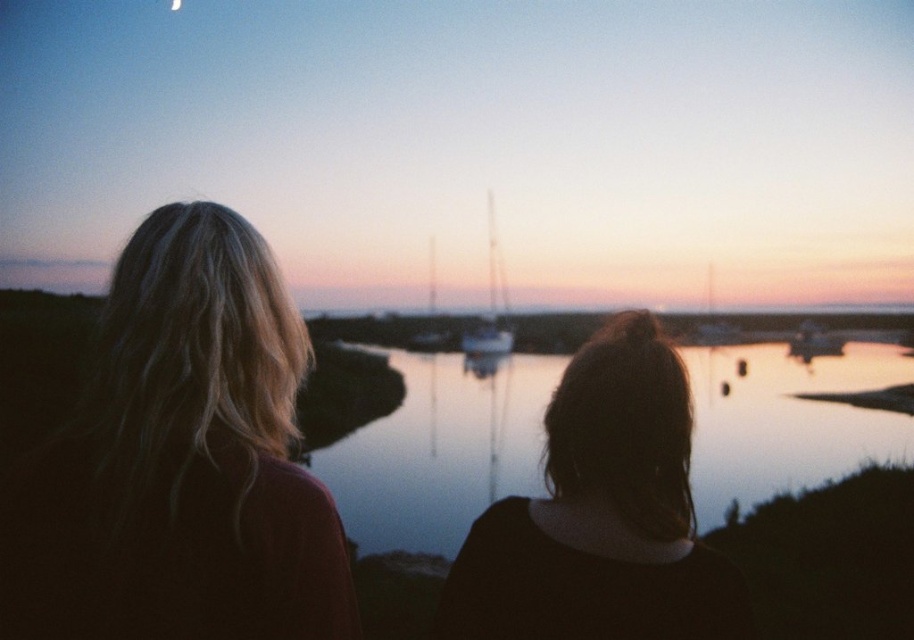
Who is more forward, (220, 605) or (541, 612)?

Point (220, 605) is more forward.

Between blonde hair at left and dark brown hair at center, which one is positioned lower?

dark brown hair at center

At what (x,y) coordinates should I click in order to perform the action: click on blonde hair at left. Please return your answer as a coordinate pair (x, y). Looking at the image, I should click on (181, 461).

I want to click on blonde hair at left, so click(x=181, y=461).

Is white glossy sailboat at center wider than metallic sailboat at center?

Yes.

Is white glossy sailboat at center to the right of metallic sailboat at center from the viewer's perspective?

Yes, white glossy sailboat at center is to the right of metallic sailboat at center.

This screenshot has width=914, height=640. Find the location of `white glossy sailboat at center`. white glossy sailboat at center is located at coordinates (491, 301).

Can you confirm if blonde hair at left is smaller than glossy water at center?

Yes, blonde hair at left is smaller than glossy water at center.

At what (x,y) coordinates should I click in order to perform the action: click on blonde hair at left. Please return your answer as a coordinate pair (x, y). The image size is (914, 640). Looking at the image, I should click on (181, 461).

Is point (119, 540) farther from camera compared to point (498, 468)?

No.

The height and width of the screenshot is (640, 914). Identify the location of blonde hair at left. (181, 461).